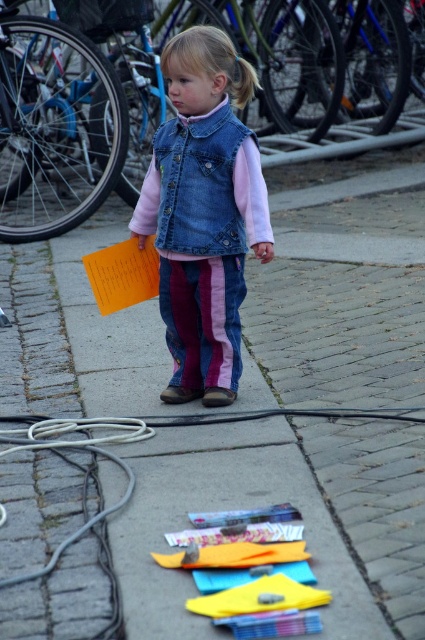
You are a photographer taking a picture of the child wearing the denim vest at center and the denim jacket at center. Which piece of clothing should you focus on first if you want to capture them in order from left to right?

The denim vest at center should be focused on first because it is positioned on the left side of the denim jacket at center.

You are a photographer trying to capture a clear shot of both the denim jacket at center and the yellow fabric toy at lower center. Since you want both items to be in focus, you need to adjust your camera so that it focuses on the item that is farther away from you. Which item should you focus on?

The denim jacket at center is closer to the viewer than the yellow fabric toy at lower center, so you should focus on the yellow fabric toy at lower center to ensure both are in focus.